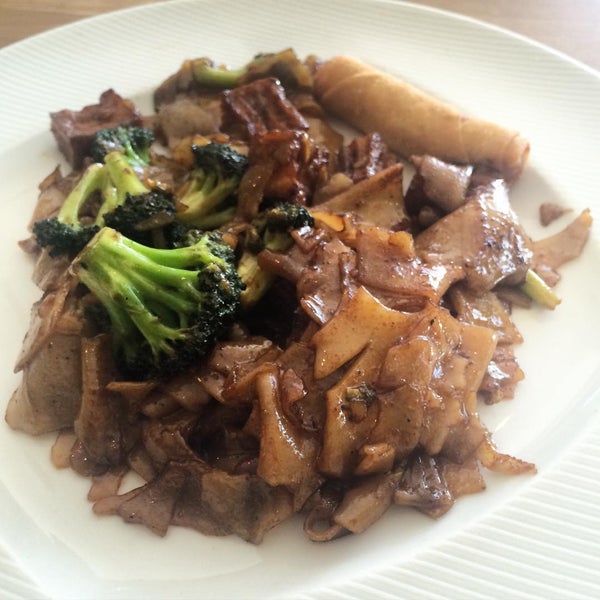
This screenshot has height=600, width=600. What are the coordinates of `white plate` in the screenshot? It's located at (47, 43), (284, 550), (77, 550), (485, 30), (589, 115), (568, 412), (444, 533).